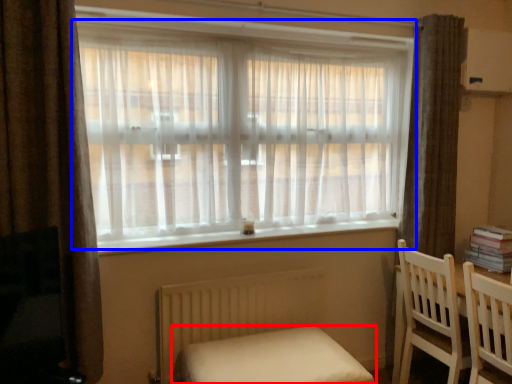
Question: Which point is closer to the camera, furniture (highlighted by a red box) or window (highlighted by a blue box)?

Choices:
 (A) furniture
 (B) window

Answer: (A)